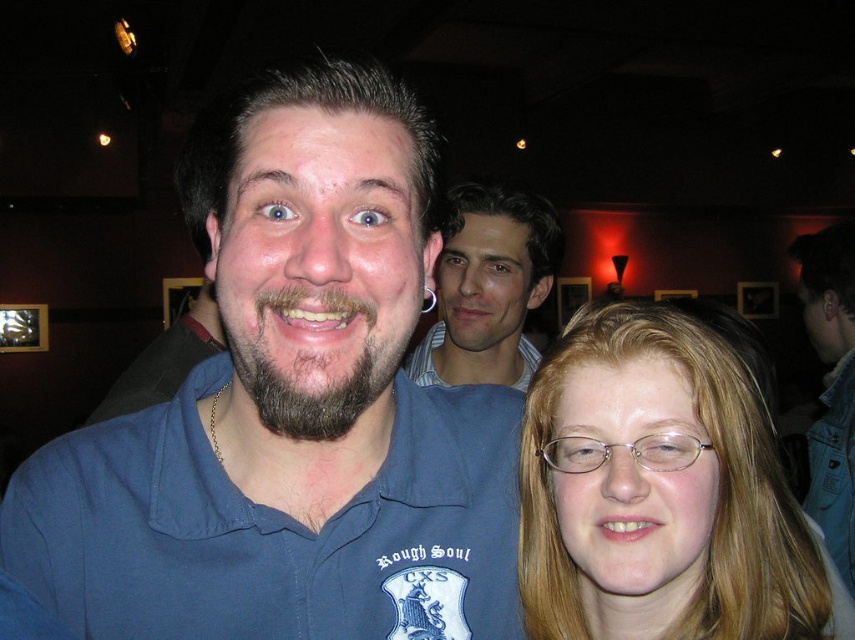
Who is more forward, [399,464] or [458,376]?

Point [399,464] is in front.

In the scene shown: Between blue cotton polo shirt at center and smooth skin face at center, which one appears on the right side from the viewer's perspective?

smooth skin face at center

You are a GUI agent. You are given a task and a screenshot of the screen. Output one action in this format:
    pyautogui.click(x=<x>, y=<y>)
    Task: Click on the blue cotton polo shirt at center
    The height and width of the screenshot is (640, 855).
    Given the screenshot: What is the action you would take?
    pyautogui.click(x=272, y=529)

Can you confirm if blue cotton shirt at center is smaller than denim jacket at lower right?

Yes.

Between blue cotton shirt at center and denim jacket at lower right, which one appears on the right side from the viewer's perspective?

From the viewer's perspective, denim jacket at lower right appears more on the right side.

Locate an element on the screen. blue cotton shirt at center is located at coordinates (292, 413).

Which is in front, point (405, 545) or point (565, 346)?

Point (565, 346) is in front.

Is point (458, 552) positioned in front of point (674, 355)?

No, it is behind (674, 355).

This screenshot has height=640, width=855. Find the location of `blue cotton polo shirt at center`. blue cotton polo shirt at center is located at coordinates (272, 529).